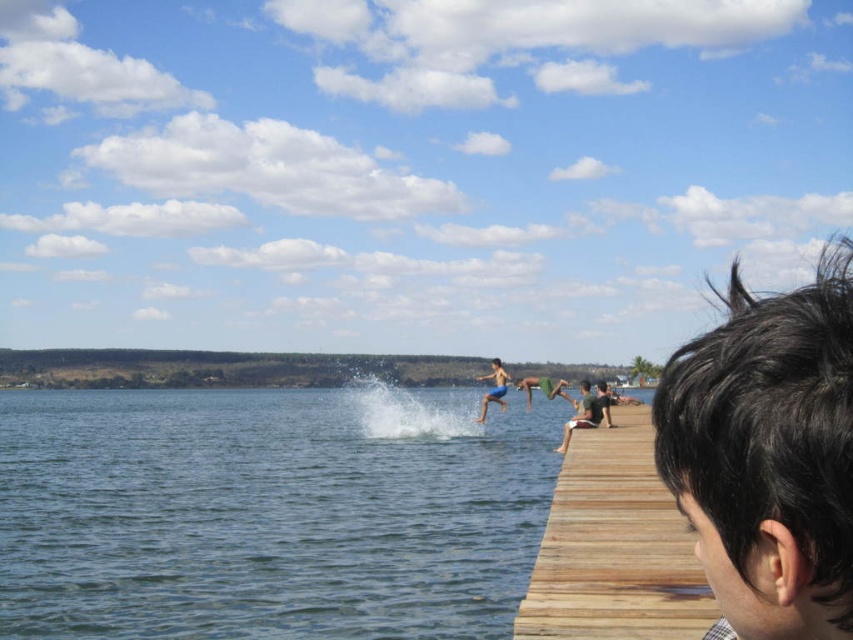
Question: Which of these objects is positioned closest to the clear blue water at center?

Choices:
 (A) blue fabric shorts at center
 (B) wooden dock at right
 (C) smooth skin child at center

Answer: (A)

Question: Is dark brown hair at right to the right of smooth skin child at center from the viewer's perspective?

Choices:
 (A) no
 (B) yes

Answer: (A)

Question: Can you confirm if clear blue water at center is positioned to the left of blue fabric shorts at center?

Choices:
 (A) no
 (B) yes

Answer: (B)

Question: Which of the following is the closest to the observer?

Choices:
 (A) dark brown hair at right
 (B) clear blue water at center
 (C) smooth skin child at center
 (D) wooden dock at right

Answer: (A)

Question: Which is farther from the blue fabric shorts at center?

Choices:
 (A) wooden dock at right
 (B) clear blue water at center
 (C) smooth skin child at center
 (D) dark brown hair at right

Answer: (D)

Question: Does wooden dock at right have a lesser width compared to smooth skin child at center?

Choices:
 (A) yes
 (B) no

Answer: (B)